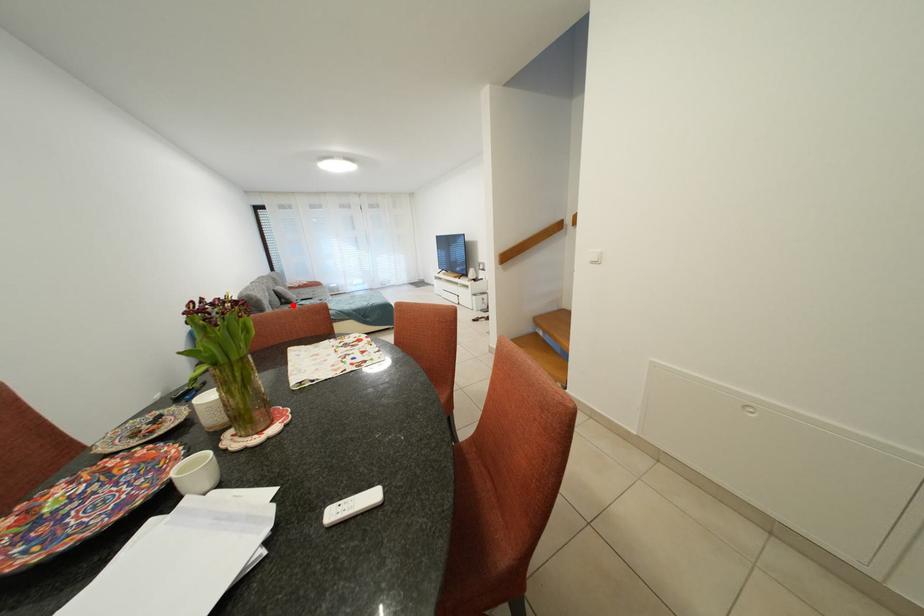
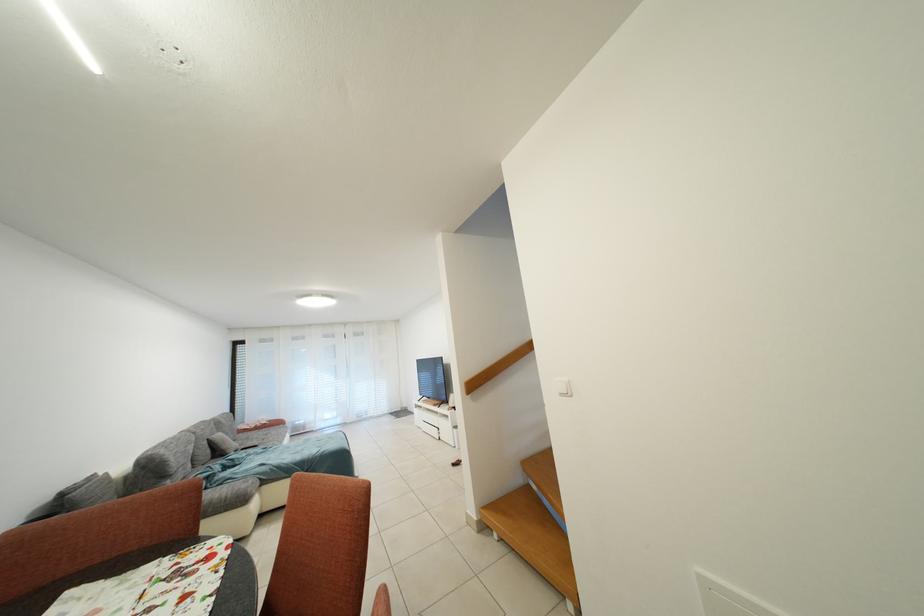
Question: I am providing you with two images of the same scene from different viewpoints. A red point is shown in image1. For the corresponding object point in image2, is it positioned nearer or farther from the camera?

Choices:
 (A) Nearer
 (B) Farther

Answer: (B)